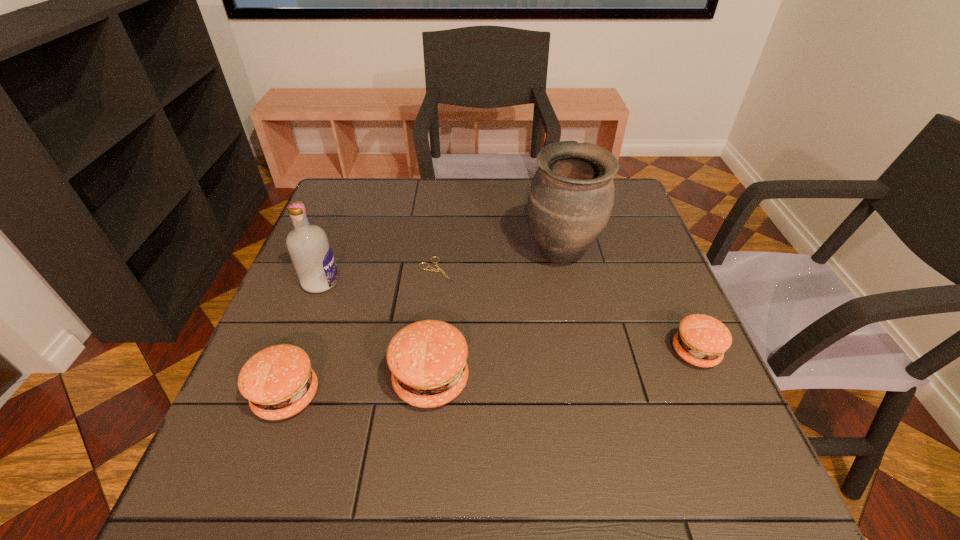
The height and width of the screenshot is (540, 960). Identify the location of vacant region that satisfies the following two spatial constraints: 1. on the label of the fifth shortest object; 2. on the left side of the tallest patty. (283, 381).